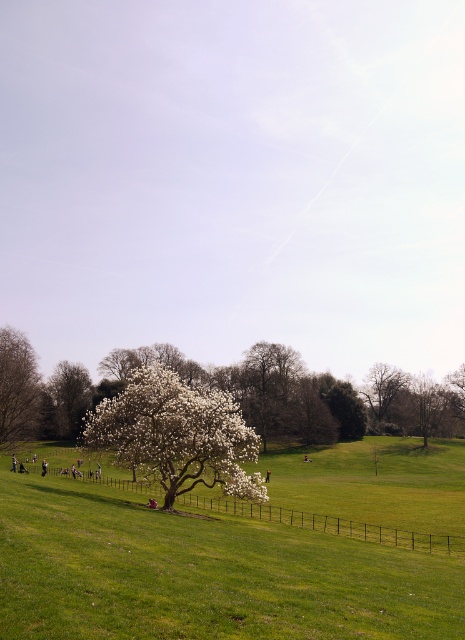
Locate an element on the screen. Image resolution: width=465 pixels, height=640 pixels. white fluffy tree at center is located at coordinates (177, 435).

Which of these two, white fluffy tree at center or white textured tree at left, stands shorter?

With less height is white fluffy tree at center.

Which is in front, point (171, 456) or point (32, 420)?

Point (171, 456)

This screenshot has height=640, width=465. In order to click on white fluffy tree at center in this screenshot , I will do `click(177, 435)`.

Can you confirm if green grassy field at center is taller than white fluffy tree at lower left?

Correct, green grassy field at center is much taller as white fluffy tree at lower left.

Based on the photo, who is taller, green grassy field at center or white fluffy tree at lower left?

With more height is green grassy field at center.

Who is more distant from viewer, (x=301, y=596) or (x=66, y=410)?

The point (x=66, y=410) is more distant.

The height and width of the screenshot is (640, 465). What are the coordinates of `green grassy field at center` in the screenshot? It's located at (203, 573).

Who is more forward, (27, 416) or (378, 388)?

Positioned in front is point (27, 416).

Image resolution: width=465 pixels, height=640 pixels. Find the location of `white textured tree at left`. white textured tree at left is located at coordinates (18, 387).